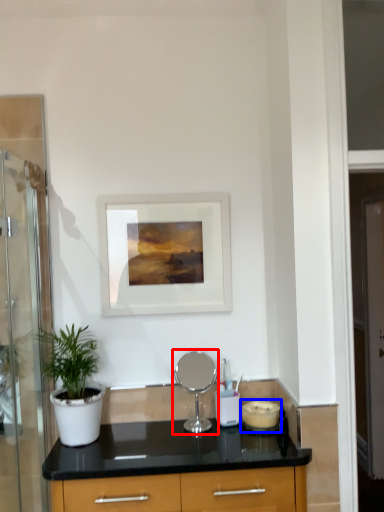
Question: Among these objects, which one is nearest to the camera, appliance (highlighted by a red box) or appliance (highlighted by a blue box)?

Choices:
 (A) appliance
 (B) appliance

Answer: (A)